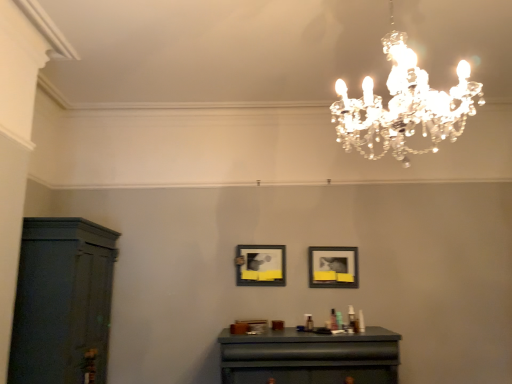
Question: Is clear crystal chandelier at upper center not near dark wood cabinet at left?

Choices:
 (A) yes
 (B) no

Answer: (A)

Question: Does clear crystal chandelier at upper center lie in front of dark wood cabinet at left?

Choices:
 (A) no
 (B) yes

Answer: (B)

Question: Considering the relative sizes of clear crystal chandelier at upper center and dark wood cabinet at left in the image provided, is clear crystal chandelier at upper center smaller than dark wood cabinet at left?

Choices:
 (A) no
 (B) yes

Answer: (B)

Question: Does clear crystal chandelier at upper center come behind dark wood cabinet at left?

Choices:
 (A) no
 (B) yes

Answer: (A)

Question: Does clear crystal chandelier at upper center have a lesser height compared to dark wood cabinet at left?

Choices:
 (A) no
 (B) yes

Answer: (B)

Question: In terms of size, does matte black table at center appear bigger or smaller than matte black picture frame at center, which is counted as the second picture frame, starting from the left?

Choices:
 (A) big
 (B) small

Answer: (A)

Question: In the image, is matte black table at center positioned in front of or behind matte black picture frame at center, the 1th picture frame viewed from the right?

Choices:
 (A) front
 (B) behind

Answer: (A)

Question: From a real-world perspective, is matte black table at center physically located above or below matte black picture frame at center, the 1th picture frame viewed from the right?

Choices:
 (A) below
 (B) above

Answer: (A)

Question: From the image's perspective, is matte black table at center above or below matte black picture frame at center, the 1th picture frame viewed from the right?

Choices:
 (A) below
 (B) above

Answer: (A)

Question: From the image's perspective, relative to matte black picture frame at center, the 1th picture frame viewed from the right, is matte black picture frame at center, placed as the first picture frame when sorted from left to right, above or below?

Choices:
 (A) below
 (B) above

Answer: (B)

Question: Considering the positions of point (269, 264) and point (310, 284), is point (269, 264) closer or farther from the camera than point (310, 284)?

Choices:
 (A) farther
 (B) closer

Answer: (A)

Question: Is matte black picture frame at center, the 2th picture frame in the right-to-left sequence, in front of or behind matte black picture frame at center, the 1th picture frame viewed from the right, in the image?

Choices:
 (A) behind
 (B) front

Answer: (B)

Question: Which is correct: matte black picture frame at center, placed as the first picture frame when sorted from left to right, is inside matte black picture frame at center, the 1th picture frame viewed from the right, or outside of it?

Choices:
 (A) outside
 (B) inside

Answer: (A)

Question: From the image's perspective, is matte black picture frame at center, the 2th picture frame in the right-to-left sequence, located above or below dark wood cabinet at left?

Choices:
 (A) below
 (B) above

Answer: (B)

Question: Considering the positions of matte black picture frame at center, placed as the first picture frame when sorted from left to right, and dark wood cabinet at left in the image, is matte black picture frame at center, placed as the first picture frame when sorted from left to right, bigger or smaller than dark wood cabinet at left?

Choices:
 (A) small
 (B) big

Answer: (A)